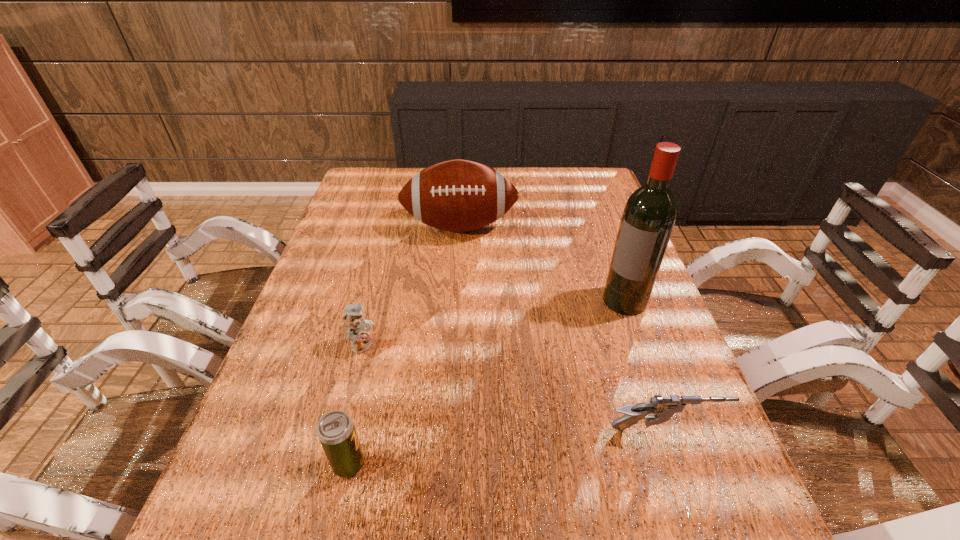
You are a GUI agent. You are given a task and a screenshot of the screen. Output one action in this format:
    pyautogui.click(x=<x>, y=<y>)
    Task: Click on the free space on the desktop that is between the beer can and the gun and is positioned on the label of the tallest object
    
    Given the screenshot: What is the action you would take?
    pyautogui.click(x=505, y=447)

In order to click on free spot on the desktop that is between the beer can and the gun and is positioned on the laces of the farthest object in this screenshot , I will do `click(465, 451)`.

You are a GUI agent. You are given a task and a screenshot of the screen. Output one action in this format:
    pyautogui.click(x=<x>, y=<y>)
    Task: Click on the vacant spot on the desktop that is between the beer can and the fourth farthest object and is positioned on the front-facing side of the teddy bear
    This screenshot has width=960, height=540.
    Given the screenshot: What is the action you would take?
    pyautogui.click(x=556, y=442)